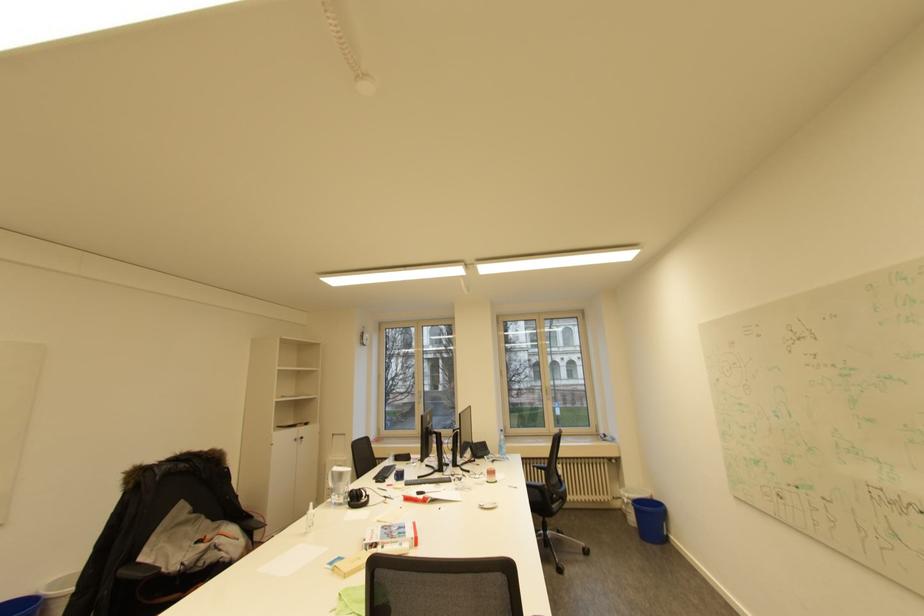
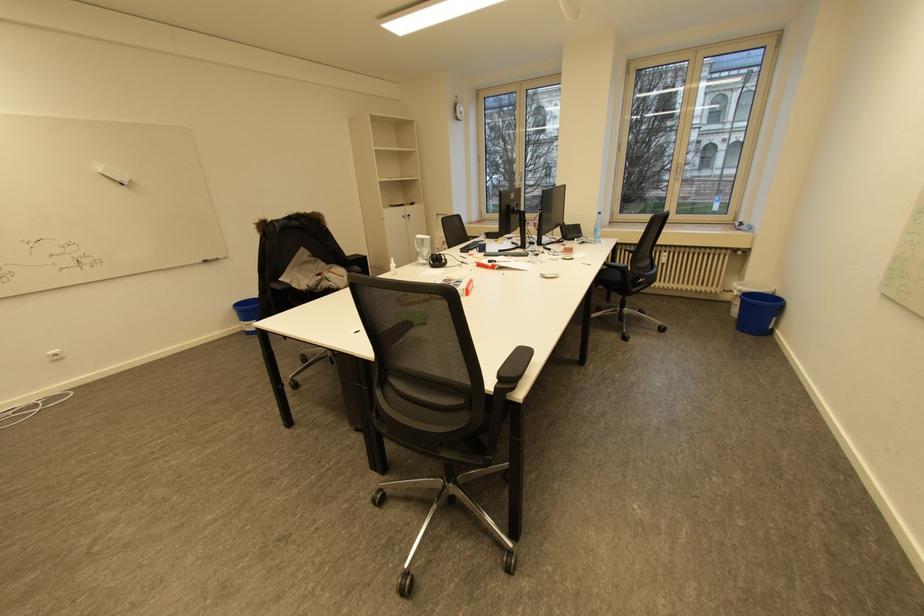
Find the pixel in the second image that matches [635,498] in the first image.

(746, 292)